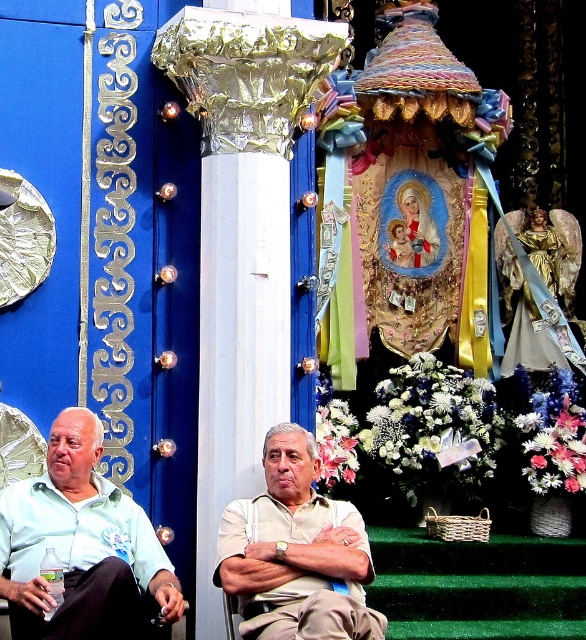
Question: Where is silver foil column at center located in relation to light beige cotton shirt at center in the image?

Choices:
 (A) left
 (B) right

Answer: (A)

Question: Considering the real-world distances, which object is closest to the light green fabric shirt at center?

Choices:
 (A) light blue cotton shirt at center
 (B) silver foil column at center
 (C) light beige cotton shirt at center

Answer: (A)

Question: Which object is the farthest from the light green fabric shirt at center?

Choices:
 (A) light beige cotton shirt at center
 (B) silver foil column at center

Answer: (A)

Question: Does silver foil column at center have a larger size compared to light blue cotton shirt at center?

Choices:
 (A) no
 (B) yes

Answer: (B)

Question: Is the position of silver foil column at center less distant than that of light blue cotton shirt at center?

Choices:
 (A) yes
 (B) no

Answer: (B)

Question: Among these objects, which one is farthest from the camera?

Choices:
 (A) light green fabric shirt at center
 (B) light blue cotton shirt at center
 (C) light beige cotton shirt at center

Answer: (C)